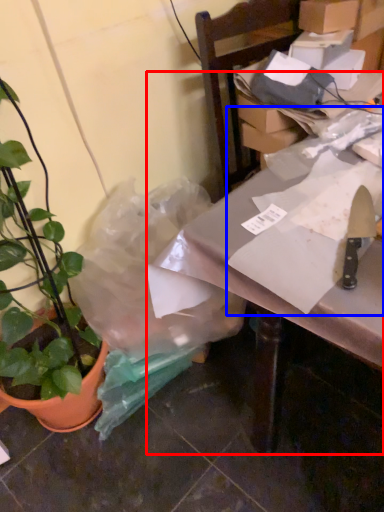
Question: Which of the following is the farthest to the observer, table (highlighted by a red box) or wrapping paper (highlighted by a blue box)?

Choices:
 (A) table
 (B) wrapping paper

Answer: (B)